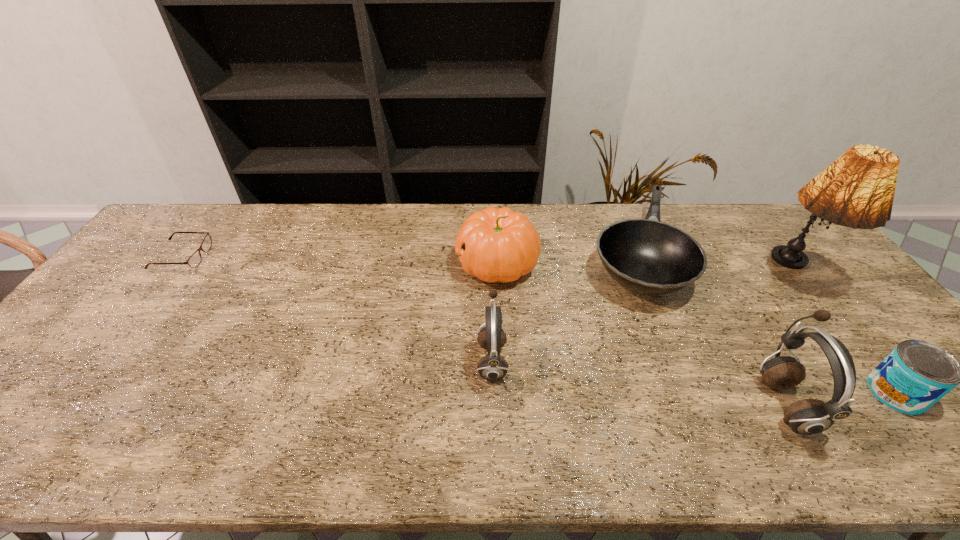
Where is `free space for a new earphone on the left`? Image resolution: width=960 pixels, height=540 pixels. free space for a new earphone on the left is located at coordinates (243, 323).